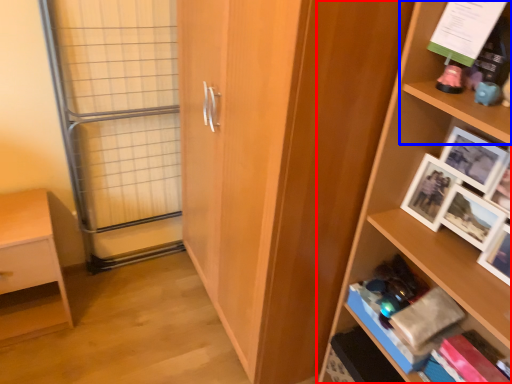
Question: Which point is further to the camera, shelf (highlighted by a red box) or shelf (highlighted by a blue box)?

Choices:
 (A) shelf
 (B) shelf

Answer: (B)